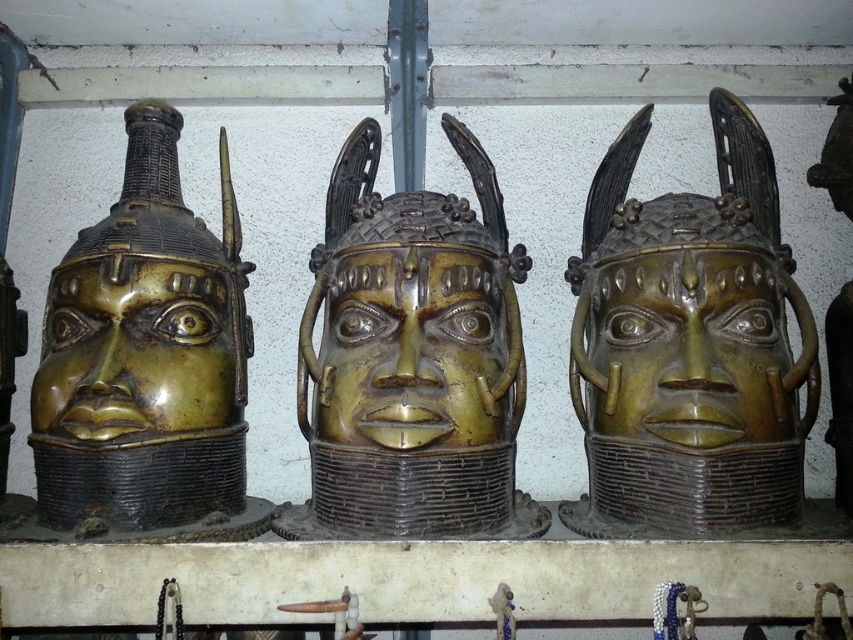
Between gold-bronze helmet at center and bronze mask at center, which one is positioned lower?

bronze mask at center is lower down.

Is point (486, 474) positioned after point (699, 401)?

Yes, it is.

Which is behind, point (332, 324) or point (791, 406)?

The point (332, 324) is more distant.

Where is `gold-bronze helmet at center`? The height and width of the screenshot is (640, 853). gold-bronze helmet at center is located at coordinates (412, 358).

Where is `bronze helmet at center`? bronze helmet at center is located at coordinates (688, 346).

The image size is (853, 640). What do you see at coordinates (688, 346) in the screenshot?
I see `bronze helmet at center` at bounding box center [688, 346].

What are the coordinates of `bronze helmet at center` in the screenshot? It's located at (688, 346).

Is point (352, 474) closer to camera compared to point (347, 296)?

Yes, it is.

Between point (368, 262) and point (399, 360), which one is positioned in front?

Point (399, 360) is in front.

Image resolution: width=853 pixels, height=640 pixels. I want to click on gold-bronze helmet at center, so click(x=412, y=358).